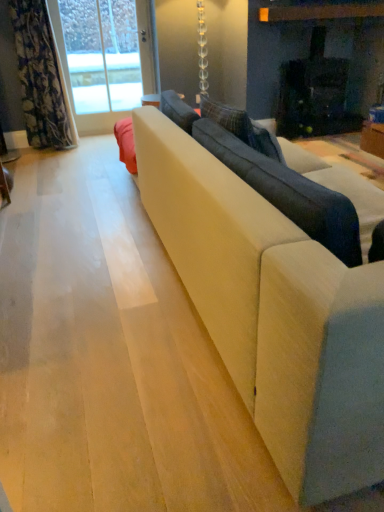
Question: Considering their positions, is suede-like beige couch at center located in front of or behind clear glass door at upper left?

Choices:
 (A) behind
 (B) front

Answer: (B)

Question: Which is correct: suede-like beige couch at center is inside clear glass door at upper left, or outside of it?

Choices:
 (A) outside
 (B) inside

Answer: (A)

Question: Which object is the farthest from the suede-like beige couch at center?

Choices:
 (A) clear glass door at upper left
 (B) floral fabric curtain at left
 (C) suede-like beige couch at center

Answer: (A)

Question: Which of these objects is positioned closest to the suede-like beige couch at center?

Choices:
 (A) suede-like beige couch at center
 (B) clear glass door at upper left
 (C) floral fabric curtain at left

Answer: (A)